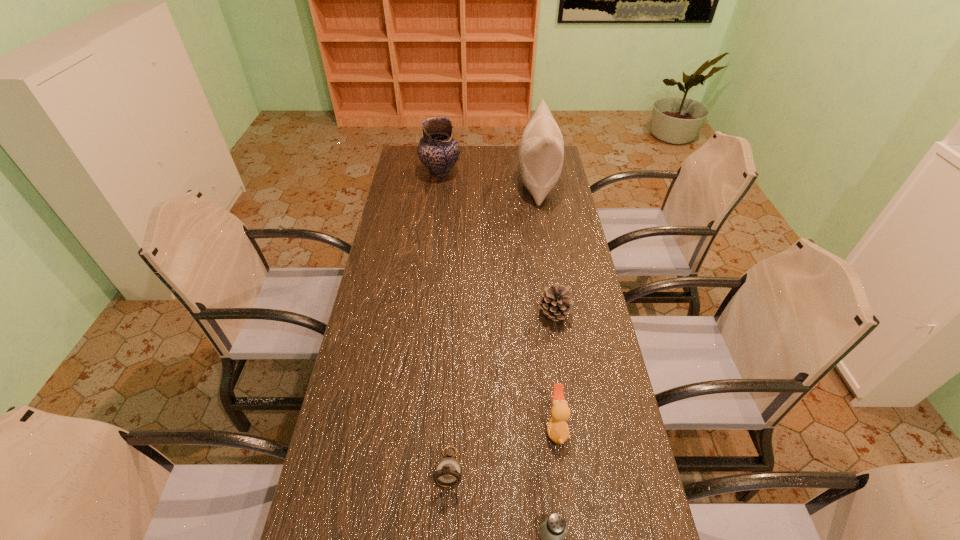
Identify the location of cushion. (541, 153).

Locate an element on the screen. the fifth shortest object is located at coordinates (438, 151).

I want to click on the third farthest object, so click(x=555, y=302).

Find the location of a particular element. Image resolution: width=960 pixels, height=540 pixels. duck is located at coordinates (557, 429).

Where is `compass`? The width and height of the screenshot is (960, 540). compass is located at coordinates (448, 471).

You are a GUI agent. You are given a task and a screenshot of the screen. Output one action in this format:
    pyautogui.click(x=<x>, y=<y>)
    Task: Click on the vacant region located 0.210m on the front side of the tallest object
    This screenshot has height=540, width=960.
    Given the screenshot: What is the action you would take?
    pyautogui.click(x=469, y=185)

This screenshot has width=960, height=540. Find the location of `vacant space located on the front side of the tallest object`. vacant space located on the front side of the tallest object is located at coordinates (450, 185).

Identify the location of free space located on the front side of the tallest object. This screenshot has width=960, height=540. (439, 185).

Locate an element on the screen. The height and width of the screenshot is (540, 960). blank area located 0.260m on the front of the second tallest object is located at coordinates (435, 218).

Where is `vacant space located 0.380m on the back of the third farthest object`? vacant space located 0.380m on the back of the third farthest object is located at coordinates 540,229.